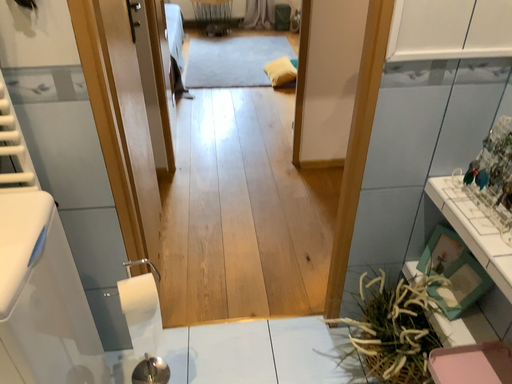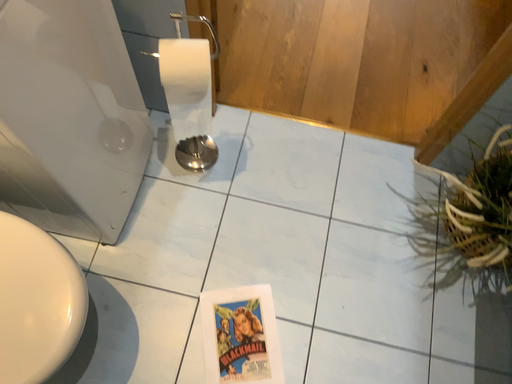
Question: Which way did the camera rotate in the video?

Choices:
 (A) rotated upward
 (B) rotated downward

Answer: (B)